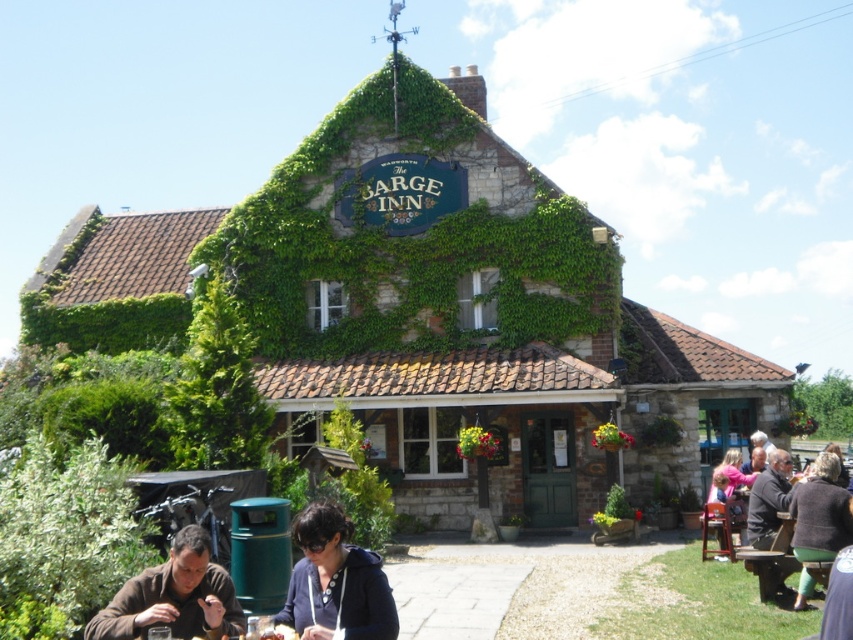
Who is positioned more to the left, dark brown leather jacket at lower right or dark brown woolen sweater at lower right?

dark brown woolen sweater at lower right

Does dark brown leather jacket at lower right come in front of dark brown woolen sweater at lower right?

No, it is not.

The width and height of the screenshot is (853, 640). What do you see at coordinates (799, 509) in the screenshot?
I see `dark brown leather jacket at lower right` at bounding box center [799, 509].

Where is `dark brown leather jacket at lower right`? The width and height of the screenshot is (853, 640). dark brown leather jacket at lower right is located at coordinates (799, 509).

Measure the distance from dark blue hoodie at center to brown wooden picnic table at lower right.

dark blue hoodie at center is 21.06 meters from brown wooden picnic table at lower right.

Where is `dark blue hoodie at center`? The height and width of the screenshot is (640, 853). dark blue hoodie at center is located at coordinates (335, 580).

Who is more forward, (299, 515) or (759, 579)?

Point (759, 579) is more forward.

Find the location of a particular element. Image resolution: width=853 pixels, height=640 pixels. dark blue hoodie at center is located at coordinates (335, 580).

Where is `brown leather jacket at lower left`? The width and height of the screenshot is (853, 640). brown leather jacket at lower left is located at coordinates (173, 596).

Is brown leather jacket at lower left to the right of brown wooden picnic table at lower right from the viewer's perspective?

Incorrect, brown leather jacket at lower left is not on the right side of brown wooden picnic table at lower right.

The width and height of the screenshot is (853, 640). What do you see at coordinates (173, 596) in the screenshot?
I see `brown leather jacket at lower left` at bounding box center [173, 596].

Locate an element on the screen. brown leather jacket at lower left is located at coordinates (173, 596).